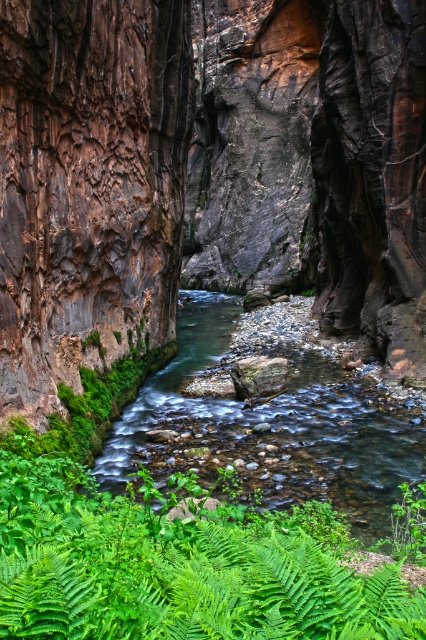
Question: Is green leafy ferns at center to the right of clear water stream at center from the viewer's perspective?

Choices:
 (A) no
 (B) yes

Answer: (A)

Question: Based on their relative distances, which object is farther from the clear water stream at center?

Choices:
 (A) green leafy ferns at center
 (B) brown rough cliff at left

Answer: (A)

Question: Estimate the real-world distances between objects in this image. Which object is farther from the brown rough cliff at left?

Choices:
 (A) green leafy ferns at center
 (B) clear water stream at center

Answer: (A)

Question: Which of these objects is positioned closest to the green leafy ferns at center?

Choices:
 (A) brown rough cliff at left
 (B) clear water stream at center

Answer: (A)

Question: Is green leafy ferns at center smaller than clear water stream at center?

Choices:
 (A) no
 (B) yes

Answer: (B)

Question: Is green leafy ferns at center closer to camera compared to clear water stream at center?

Choices:
 (A) no
 (B) yes

Answer: (B)